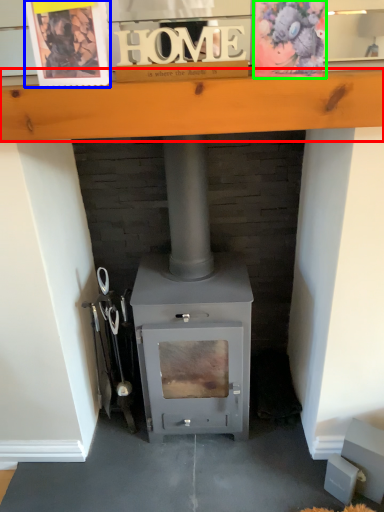
Question: Estimate the real-world distances between objects in this image. Which object is farther from ledge (highlighted by a red box), postcard (highlighted by a blue box) or postcard (highlighted by a green box)?

Choices:
 (A) postcard
 (B) postcard

Answer: (B)